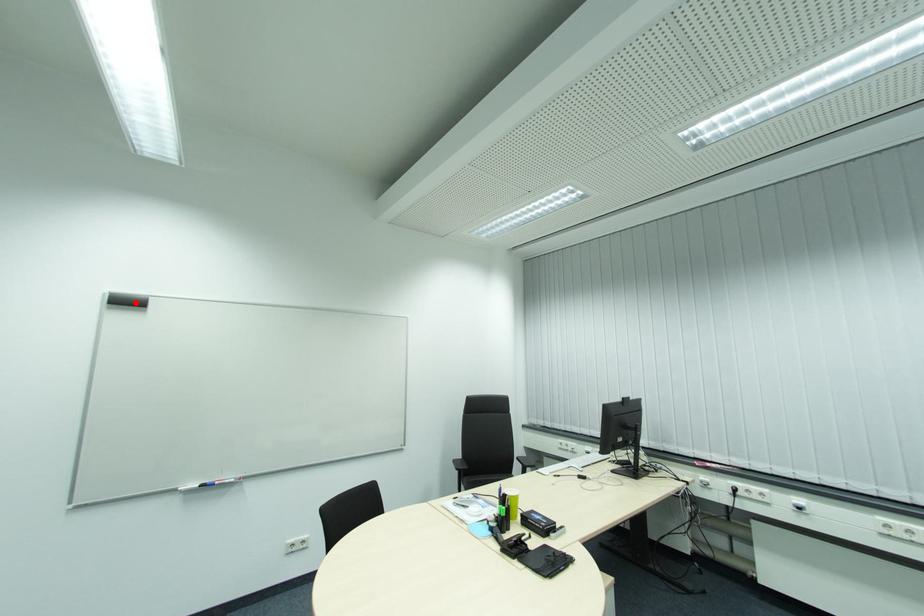
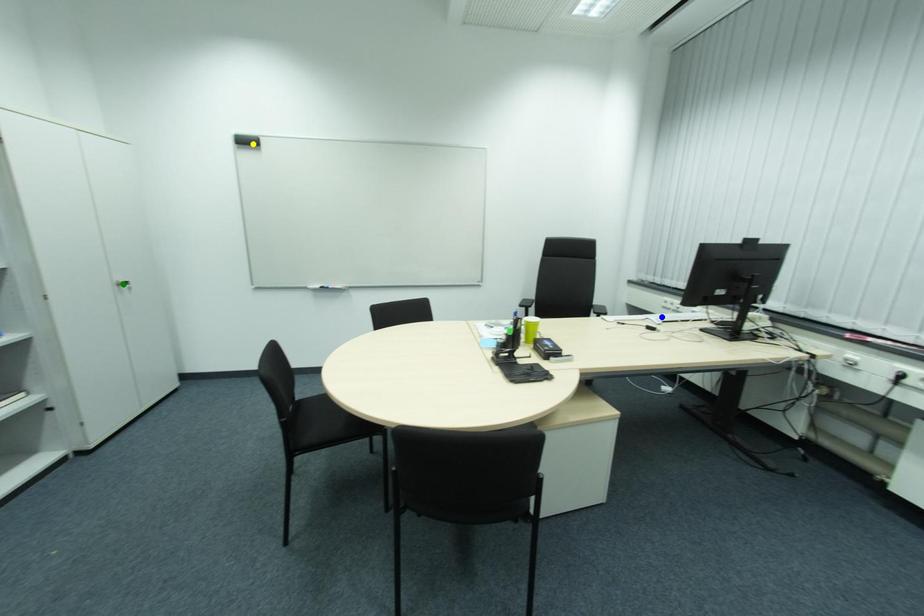
Question: I am providing you with two images of the same scene from different viewpoints. A red point is marked on the first image. You are given multiple points on the second image. Which mark in image 2 goes with the point in image 1?

Choices:
 (A) green point
 (B) blue point
 (C) yellow point

Answer: (C)